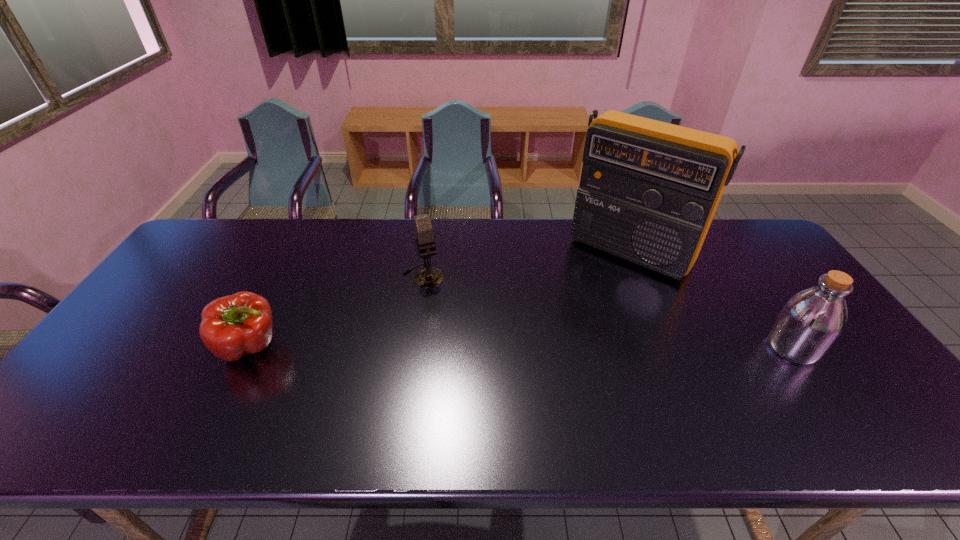
At what (x,y) coordinates should I click in order to perform the action: click on vacant point located between the third object from right to left and the pepper. Please return your answer as a coordinate pair (x, y). The width and height of the screenshot is (960, 540). Looking at the image, I should click on (337, 311).

Where is `vacant region between the rightmost object and the shortest object`? vacant region between the rightmost object and the shortest object is located at coordinates (522, 347).

What are the coordinates of `vacant area that lies between the radio receiver and the rightmost object` in the screenshot? It's located at (711, 300).

Where is `vacant space in between the third object from right to left and the leftmost object`? The width and height of the screenshot is (960, 540). vacant space in between the third object from right to left and the leftmost object is located at coordinates (337, 311).

Identify the location of vacant area that lies between the microphone and the radio receiver. (527, 264).

Image resolution: width=960 pixels, height=540 pixels. What are the coordinates of `free space that is in between the shortest object and the microphone` in the screenshot? It's located at (337, 311).

Locate an element on the screen. Image resolution: width=960 pixels, height=540 pixels. free spot between the rightmost object and the radio receiver is located at coordinates click(x=711, y=300).

You are a GUI agent. You are given a task and a screenshot of the screen. Output one action in this format:
    pyautogui.click(x=<x>, y=<y>)
    Task: Click on the free spot between the radio receiver and the bottle
    The image size is (960, 540).
    Given the screenshot: What is the action you would take?
    pyautogui.click(x=711, y=300)

This screenshot has width=960, height=540. What are the coordinates of `vacant area between the radio receiver and the third object from right to left` in the screenshot? It's located at (527, 264).

Identify the location of free space between the pepper and the rightmost object. (522, 347).